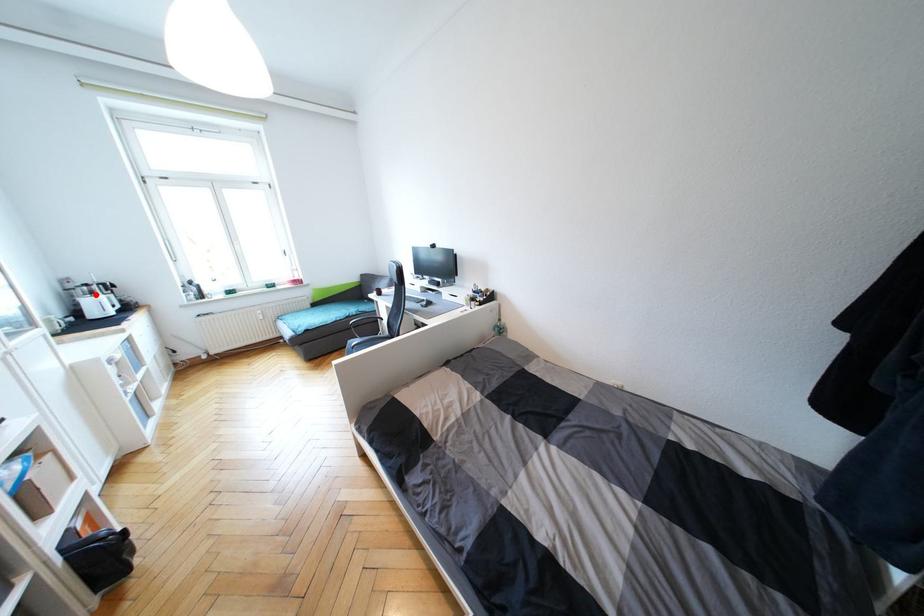
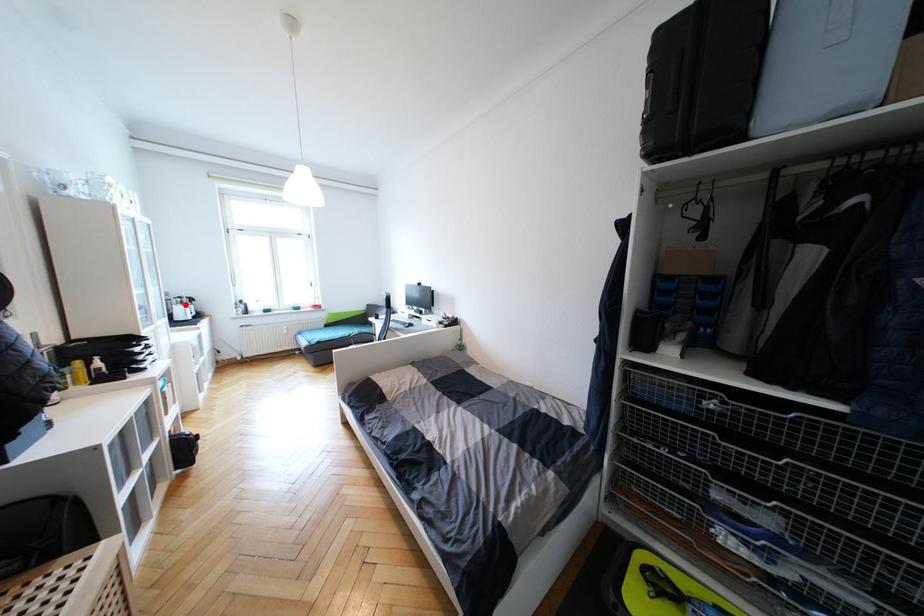
I am providing you with two images of the same scene from different viewpoints. A red point is marked on the first image and another point is marked on the second image. Do the highlighted points in image1 and image2 indicate the same real-world spot?

Yes